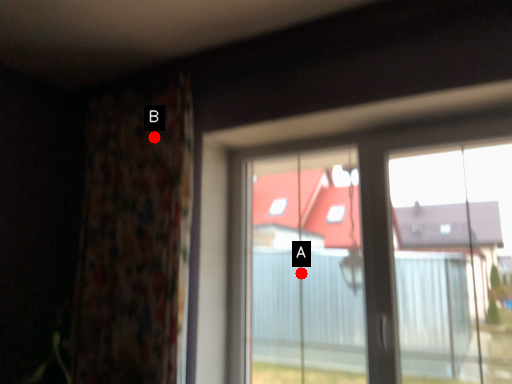
Question: Two points are circled on the image, labeled by A and B beside each circle. Which point appears farthest from the camera in this image?

Choices:
 (A) A is further
 (B) B is further

Answer: (A)